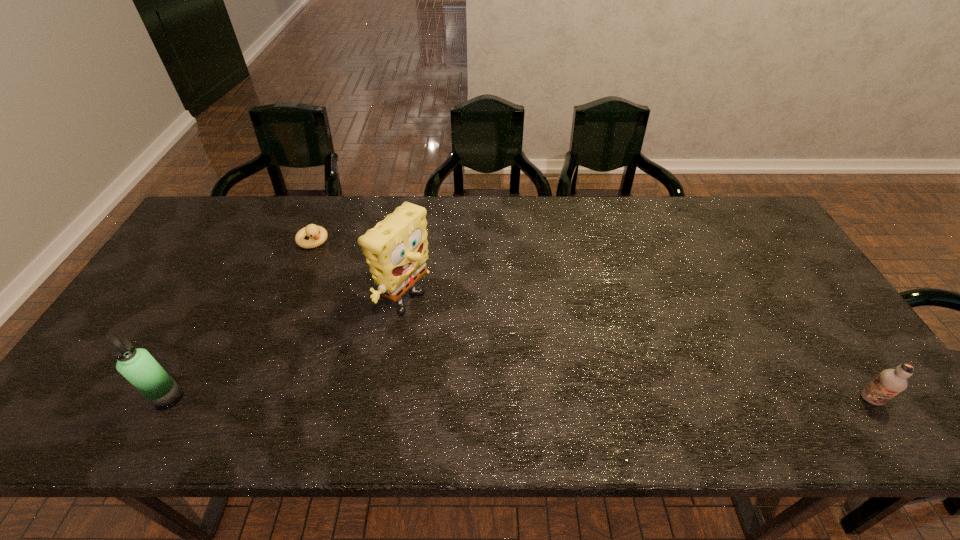
This screenshot has height=540, width=960. What are the coordinates of `object that is at the near right corner` in the screenshot? It's located at (890, 382).

At what (x,y) coordinates should I click in order to perform the action: click on vacant space at the far edge of the desktop. Please return your answer as a coordinate pair (x, y). Image resolution: width=960 pixels, height=540 pixels. Looking at the image, I should click on (384, 202).

Find the location of a particular element. vacant space at the near edge is located at coordinates (610, 391).

In the image, there is a desktop. Identify the location of vacant region at the left edge. The width and height of the screenshot is (960, 540). (156, 330).

I want to click on vacant point at the right edge, so click(771, 280).

This screenshot has height=540, width=960. In the image, there is a desktop. Identify the location of vacant space at the far left corner. (237, 206).

Locate an element on the screen. Image resolution: width=960 pixels, height=540 pixels. vacant space at the near left corner of the desktop is located at coordinates (118, 389).

The height and width of the screenshot is (540, 960). I want to click on vacant area that lies between the third tallest object and the third object from right to left, so click(591, 320).

You are a GUI agent. You are given a task and a screenshot of the screen. Output one action in this format:
    pyautogui.click(x=<x>, y=<y>)
    Task: Click on the vacant area that lies between the rightmost object and the leftmost object
    
    Given the screenshot: What is the action you would take?
    pyautogui.click(x=519, y=399)

Find the location of `free space between the sponge and the second shortest object`. free space between the sponge and the second shortest object is located at coordinates (637, 353).